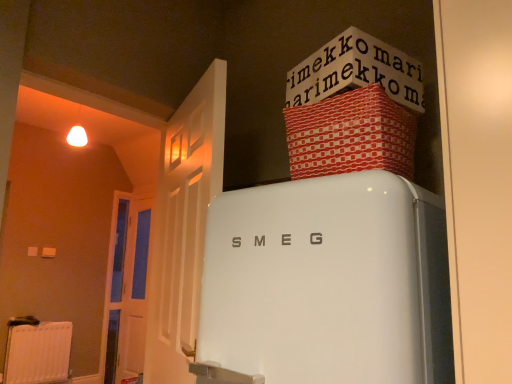
Question: Would you say white paper at upper center is to the left or to the right of red textured fabric box at upper right in the picture?

Choices:
 (A) left
 (B) right

Answer: (B)

Question: Is white paper at upper center in front of or behind red textured fabric box at upper right in the image?

Choices:
 (A) behind
 (B) front

Answer: (A)

Question: Considering the real-world distances, which object is farthest from the white plastic radiator at lower left?

Choices:
 (A) red textured fabric box at upper right
 (B) white paper at upper center
 (C) white glossy refrigerator at center
 (D) white wooden door at left, the 1th door positioned from the back
 (E) white wooden door at left, the first door from the front

Answer: (B)

Question: Which object is positioned farthest from the white glossy refrigerator at center?

Choices:
 (A) white wooden door at left, the first door from the front
 (B) white plastic radiator at lower left
 (C) white wooden door at left, the 1th door positioned from the back
 (D) red textured fabric box at upper right
 (E) white paper at upper center

Answer: (B)